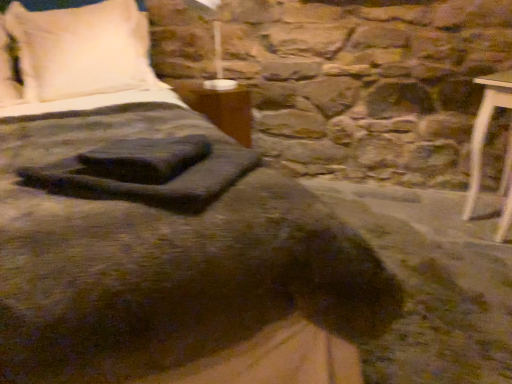
What do you see at coordinates (214, 43) in the screenshot? I see `matte white lampshade at upper center` at bounding box center [214, 43].

Where is `wooden table at center`? This screenshot has width=512, height=384. wooden table at center is located at coordinates (220, 107).

Where is `white soft pillow at upper left`? white soft pillow at upper left is located at coordinates (81, 49).

Is point (113, 26) positioned before point (223, 90)?

That is True.

From a real-world perspective, is white soft pillow at upper left below matte white lampshade at upper center?

Correct, in the physical world, white soft pillow at upper left is lower than matte white lampshade at upper center.

Considering the relative sizes of white soft pillow at upper left and matte white lampshade at upper center in the image provided, is white soft pillow at upper left shorter than matte white lampshade at upper center?

No.

Does wooden table at center have a larger size compared to matte white lampshade at upper center?

Incorrect, wooden table at center is not larger than matte white lampshade at upper center.

Is wooden table at center located outside matte white lampshade at upper center?

Absolutely, wooden table at center is external to matte white lampshade at upper center.

Is wooden table at center facing away from matte white lampshade at upper center?

No.

Is wooden table at center next to matte white lampshade at upper center and touching it?

No.

Considering the positions of point (225, 83) and point (34, 55), is point (225, 83) closer or farther from the camera than point (34, 55)?

Point (225, 83) appears to be farther away from the viewer than point (34, 55).

Could you tell me if matte white lampshade at upper center is facing white soft pillow at upper left?

No, matte white lampshade at upper center does not turn towards white soft pillow at upper left.

Is matte white lampshade at upper center to the right of white soft pillow at upper left from the viewer's perspective?

Correct, you'll find matte white lampshade at upper center to the right of white soft pillow at upper left.

Are matte white lampshade at upper center and white soft pillow at upper left located far from each other?

No, matte white lampshade at upper center is in close proximity to white soft pillow at upper left.

In the image, is white soft pillow at upper left positioned in front of or behind wooden table at center?

white soft pillow at upper left is positioned closer to the viewer than wooden table at center.

Is white soft pillow at upper left taller or shorter than wooden table at center?

Clearly, white soft pillow at upper left is taller compared to wooden table at center.

From the image's perspective, would you say white soft pillow at upper left is positioned over wooden table at center?

Yes, from the image's perspective, white soft pillow at upper left is over wooden table at center.

Would you say wooden table at center is inside or outside white soft pillow at upper left?

wooden table at center cannot be found inside white soft pillow at upper left.

Identify the location of table below the white soft pillow at upper left (from a real-world perspective). This screenshot has height=384, width=512. (220, 107).

From a real-world perspective, is wooden table at center physically located above or below white soft pillow at upper left?

wooden table at center is below white soft pillow at upper left.

Between wooden table at center and white soft pillow at upper left, which one appears on the right side from the viewer's perspective?

wooden table at center is more to the right.

Measure the distance from matte white lampshade at upper center to wooden table at center.

matte white lampshade at upper center and wooden table at center are 15.15 inches apart.

From a real-world perspective, is matte white lampshade at upper center on top of wooden table at center?

Yes, from a real-world perspective, matte white lampshade at upper center is above wooden table at center.

Which point is more forward, (219, 80) or (220, 126)?

The point (220, 126) is closer.

From the image's perspective, which one is positioned lower, matte white lampshade at upper center or wooden table at center?

wooden table at center appears lower in the image.

Identify the location of bedside lamp that is on the right side of white soft pillow at upper left. (214, 43).

You are a GUI agent. You are given a task and a screenshot of the screen. Output one action in this format:
    pyautogui.click(x=<x>, y=<y>)
    Task: Click on the table below the matte white lampshade at upper center (from the image's perspective)
    
    Given the screenshot: What is the action you would take?
    pyautogui.click(x=220, y=107)

When comparing their distances from white soft pillow at upper left, does matte white lampshade at upper center or wooden table at center seem further?

matte white lampshade at upper center is further to white soft pillow at upper left.

Which object lies further to the anchor point matte white lampshade at upper center, white soft pillow at upper left or wooden table at center?

white soft pillow at upper left lies further to matte white lampshade at upper center than the other object.

Estimate the real-world distances between objects in this image. Which object is further from white soft pillow at upper left, wooden table at center or matte white lampshade at upper center?

matte white lampshade at upper center is further to white soft pillow at upper left.

Which object lies further to the anchor point wooden table at center, white soft pillow at upper left or matte white lampshade at upper center?

Among the two, white soft pillow at upper left is located further to wooden table at center.

Based on their spatial positions, is matte white lampshade at upper center or white soft pillow at upper left further from wooden table at center?

Based on the image, white soft pillow at upper left appears to be further to wooden table at center.

From the image, which object appears to be farther from matte white lampshade at upper center, wooden table at center or white soft pillow at upper left?

The object further to matte white lampshade at upper center is white soft pillow at upper left.

The width and height of the screenshot is (512, 384). Identify the location of table between white soft pillow at upper left and matte white lampshade at upper center in the horizontal direction. (220, 107).